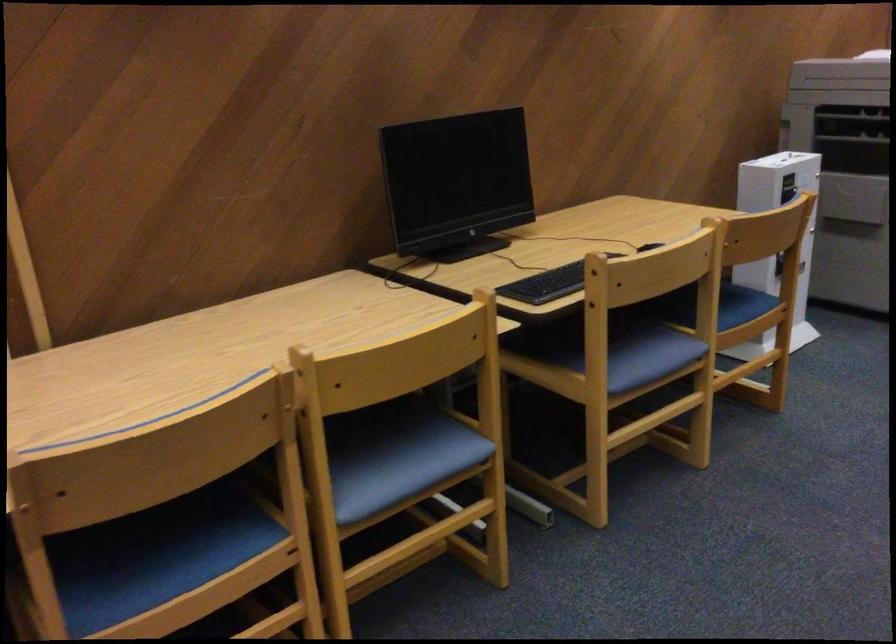
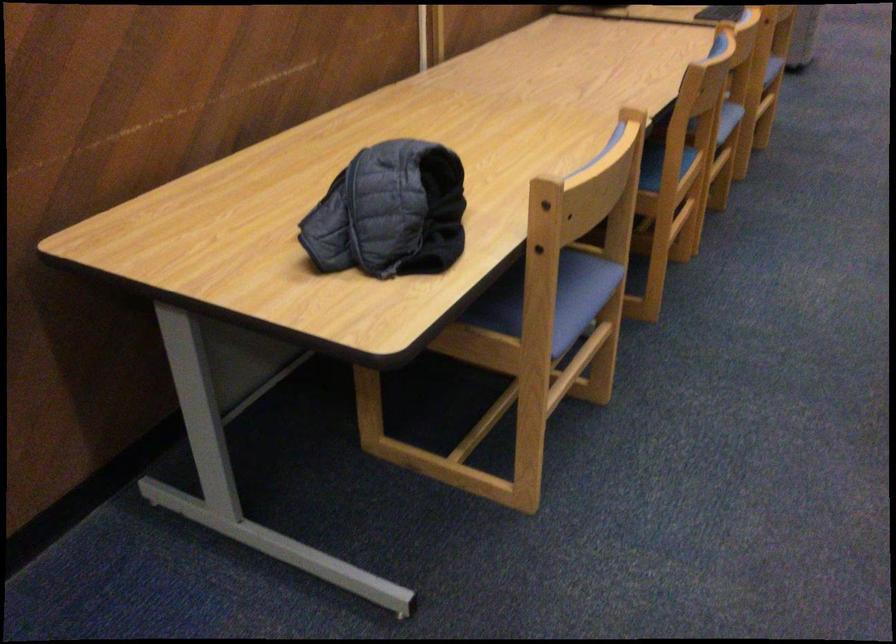
Find the pixel in the second image that matches pixel 435 471 in the first image.

(728, 118)